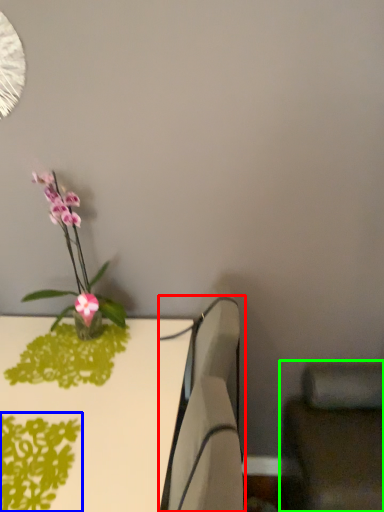
Question: Which object is positioned farthest from swivel chair (highlighted by a red box)? Select from plant (highlighted by a blue box) and swivel chair (highlighted by a green box).

Choices:
 (A) plant
 (B) swivel chair

Answer: (B)